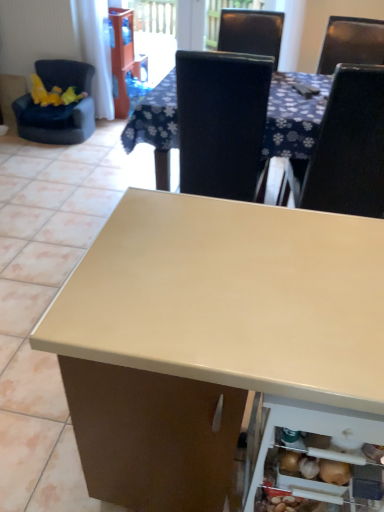
Question: Is transparent plastic screen door at upper center in contact with beige laminate table at center?

Choices:
 (A) no
 (B) yes

Answer: (A)

Question: Is transparent plastic screen door at upper center completely or partially outside of beige laminate table at center?

Choices:
 (A) yes
 (B) no

Answer: (A)

Question: Can you confirm if transparent plastic screen door at upper center is smaller than beige laminate table at center?

Choices:
 (A) yes
 (B) no

Answer: (A)

Question: Considering the relative sizes of transparent plastic screen door at upper center and beige laminate table at center in the image provided, is transparent plastic screen door at upper center thinner than beige laminate table at center?

Choices:
 (A) no
 (B) yes

Answer: (B)

Question: Can you confirm if transparent plastic screen door at upper center is positioned to the right of beige laminate table at center?

Choices:
 (A) yes
 (B) no

Answer: (B)

Question: Does transparent plastic screen door at upper center have a larger size compared to beige laminate table at center?

Choices:
 (A) yes
 (B) no

Answer: (B)

Question: From a real-world perspective, is black leather chair at upper right, which is counted as the 1th chair, starting from the bottom, positioned over white plastic shelf at lower right based on gravity?

Choices:
 (A) yes
 (B) no

Answer: (A)

Question: Is white plastic shelf at lower right located within black leather chair at upper right, marked as the 1th chair in a right-to-left arrangement?

Choices:
 (A) yes
 (B) no

Answer: (B)

Question: From the image's perspective, is black leather chair at upper right, arranged as the 2th chair when viewed from the top, on top of white plastic shelf at lower right?

Choices:
 (A) no
 (B) yes

Answer: (B)

Question: Does black leather chair at upper right, arranged as the 2th chair when viewed from the top, touch white plastic shelf at lower right?

Choices:
 (A) no
 (B) yes

Answer: (A)

Question: Considering the relative sizes of black leather chair at upper right, marked as the 1th chair in a right-to-left arrangement, and white plastic shelf at lower right in the image provided, is black leather chair at upper right, marked as the 1th chair in a right-to-left arrangement, smaller than white plastic shelf at lower right?

Choices:
 (A) yes
 (B) no

Answer: (B)

Question: From a real-world perspective, is black leather chair at upper right, which appears as the 1th chair when viewed from the front, located beneath white plastic shelf at lower right?

Choices:
 (A) no
 (B) yes

Answer: (A)

Question: Is velvet-like black armchair at left, marked as the 2th chair in a right-to-left arrangement, positioned with its back to white plastic shelf at lower right?

Choices:
 (A) no
 (B) yes

Answer: (A)